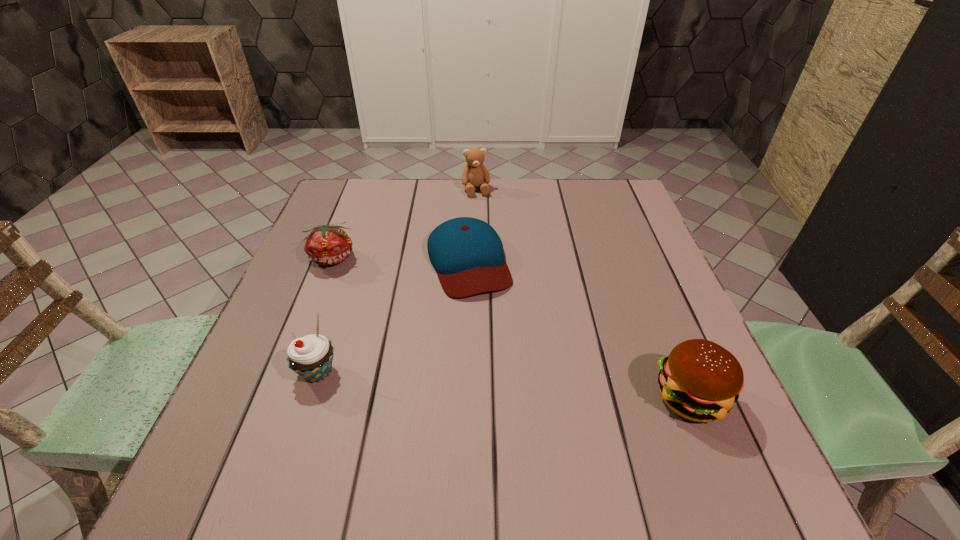
Find the location of a particular element. Image resolution: width=960 pixels, height=540 pixels. free space on the desktop that is between the cupcake and the rightmost object and is positioned on the face of the teddy bear is located at coordinates (524, 386).

Find the location of a particular element. free space on the desktop that is between the cupcake and the hamburger and is positioned on the front-facing side of the tomato is located at coordinates (459, 381).

Where is `vacant spot on the desktop that is between the cupcake and the rightmost object and is positioned with the bill of the baseball cap facing forward`? vacant spot on the desktop that is between the cupcake and the rightmost object and is positioned with the bill of the baseball cap facing forward is located at coordinates (518, 385).